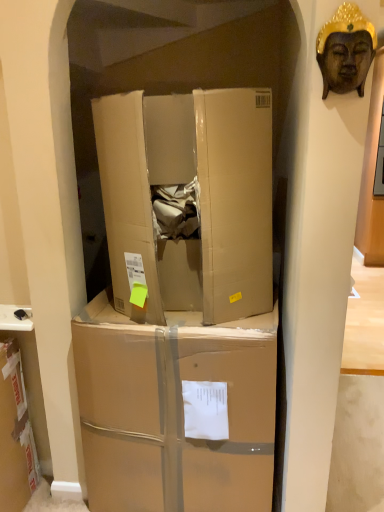
This screenshot has height=512, width=384. Identify the location of brown cardboard box at center, the 2th box positioned from the top. click(x=174, y=411).

Between point (206, 440) and point (371, 34), which one is positioned in front?

The point (371, 34) is more forward.

You are a GUI agent. You are given a task and a screenshot of the screen. Output one action in this format:
    pyautogui.click(x=<x>, y=<y>)
    Task: Click on the person above the brown cardboard box at center, arranged as the first box when ordered from the bottom (from a real-world perspective)
    
    Given the screenshot: What is the action you would take?
    pyautogui.click(x=345, y=50)

Considering the sizes of objects brown cardboard box at center, arranged as the first box when ordered from the bottom, and wooden buddha head at upper right in the image provided, who is shorter, brown cardboard box at center, arranged as the first box when ordered from the bottom, or wooden buddha head at upper right?

wooden buddha head at upper right.

Based on the photo, from a real-world perspective, which is physically above, brown cardboard box at center, the 2th box positioned from the top, or cardboard box at center, the 1th box in the top-to-bottom sequence?

In real-world perspective, cardboard box at center, the 1th box in the top-to-bottom sequence, is above.

Locate an element on the screen. The image size is (384, 512). box above the brown cardboard box at center, the 2th box positioned from the top (from the image's perspective) is located at coordinates (195, 203).

Would you say cardboard box at center, the 1th box in the top-to-bottom sequence, is part of brown cardboard box at center, the 2th box positioned from the top,'s contents?

No, cardboard box at center, the 1th box in the top-to-bottom sequence, is not inside brown cardboard box at center, the 2th box positioned from the top.

Is the position of brown cardboard box at center, arranged as the first box when ordered from the bottom, more distant than that of cardboard box at center, which is counted as the second box, starting from the bottom?

That is True.

From the image's perspective, is cardboard box at center, which is counted as the second box, starting from the bottom, on brown cardboard box at center, the 2th box positioned from the top?

Yes.

Is cardboard box at center, which is counted as the second box, starting from the bottom, closer to the viewer compared to brown cardboard box at center, arranged as the first box when ordered from the bottom?

Yes, cardboard box at center, which is counted as the second box, starting from the bottom, is in front of brown cardboard box at center, arranged as the first box when ordered from the bottom.

Is cardboard box at center, which is counted as the second box, starting from the bottom, positioned far away from brown cardboard box at center, the 2th box positioned from the top?

cardboard box at center, which is counted as the second box, starting from the bottom, is near brown cardboard box at center, the 2th box positioned from the top, not far away.

Locate an element on the screen. The image size is (384, 512). person on the right of the cardboard box at center, which is counted as the second box, starting from the bottom is located at coordinates (345, 50).

Is cardboard box at center, the 1th box in the top-to-bottom sequence, not close to wooden buddha head at upper right?

No, cardboard box at center, the 1th box in the top-to-bottom sequence, is not far away from wooden buddha head at upper right.

Can you tell me how much cardboard box at center, which is counted as the second box, starting from the bottom, and wooden buddha head at upper right differ in facing direction?

cardboard box at center, which is counted as the second box, starting from the bottom, and wooden buddha head at upper right are facing 3.39 degrees away from each other.

How distant is wooden buddha head at upper right from cardboard box at center, which is counted as the second box, starting from the bottom?

wooden buddha head at upper right and cardboard box at center, which is counted as the second box, starting from the bottom, are 21.15 inches apart from each other.

Which is behind, point (347, 9) or point (229, 89)?

Positioned behind is point (229, 89).

Is wooden buddha head at upper right located outside cardboard box at center, the 1th box in the top-to-bottom sequence?

Indeed, wooden buddha head at upper right is completely outside cardboard box at center, the 1th box in the top-to-bottom sequence.

Is wooden buddha head at upper right directly adjacent to brown cardboard box at center, the 2th box positioned from the top?

No, wooden buddha head at upper right is not next to brown cardboard box at center, the 2th box positioned from the top.

Does wooden buddha head at upper right have a larger size compared to brown cardboard box at center, the 2th box positioned from the top?

Incorrect, wooden buddha head at upper right is not larger than brown cardboard box at center, the 2th box positioned from the top.

Is wooden buddha head at upper right not within brown cardboard box at center, arranged as the first box when ordered from the bottom?

Indeed, wooden buddha head at upper right is completely outside brown cardboard box at center, arranged as the first box when ordered from the bottom.

Based on the photo, which of these two, wooden buddha head at upper right or brown cardboard box at center, the 2th box positioned from the top, is wider?

With larger width is brown cardboard box at center, the 2th box positioned from the top.

The width and height of the screenshot is (384, 512). In order to click on the 2nd box behind when counting from the wooden buddha head at upper right in this screenshot , I will do `click(174, 411)`.

Locate an element on the screen. The image size is (384, 512). box above the brown cardboard box at center, the 2th box positioned from the top (from a real-world perspective) is located at coordinates (195, 203).

Based on their spatial positions, is cardboard box at center, the 1th box in the top-to-bottom sequence, or wooden buddha head at upper right closer to brown cardboard box at center, the 2th box positioned from the top?

cardboard box at center, the 1th box in the top-to-bottom sequence, lies closer to brown cardboard box at center, the 2th box positioned from the top, than the other object.

Estimate the real-world distances between objects in this image. Which object is closer to wooden buddha head at upper right, cardboard box at center, which is counted as the second box, starting from the bottom, or brown cardboard box at center, arranged as the first box when ordered from the bottom?

Among the two, cardboard box at center, which is counted as the second box, starting from the bottom, is located nearer to wooden buddha head at upper right.

Estimate the real-world distances between objects in this image. Which object is further from wooden buddha head at upper right, brown cardboard box at center, the 2th box positioned from the top, or cardboard box at center, the 1th box in the top-to-bottom sequence?

brown cardboard box at center, the 2th box positioned from the top, is further to wooden buddha head at upper right.

Estimate the real-world distances between objects in this image. Which object is closer to cardboard box at center, which is counted as the second box, starting from the bottom, wooden buddha head at upper right or brown cardboard box at center, the 2th box positioned from the top?

brown cardboard box at center, the 2th box positioned from the top, is positioned closer to the anchor cardboard box at center, which is counted as the second box, starting from the bottom.

Based on their spatial positions, is brown cardboard box at center, arranged as the first box when ordered from the bottom, or wooden buddha head at upper right closer to cardboard box at center, the 1th box in the top-to-bottom sequence?

brown cardboard box at center, arranged as the first box when ordered from the bottom, is positioned closer to the anchor cardboard box at center, the 1th box in the top-to-bottom sequence.

From the image, which object appears to be nearer to brown cardboard box at center, arranged as the first box when ordered from the bottom, wooden buddha head at upper right or cardboard box at center, the 1th box in the top-to-bottom sequence?

cardboard box at center, the 1th box in the top-to-bottom sequence, is positioned closer to the anchor brown cardboard box at center, arranged as the first box when ordered from the bottom.

Locate an element on the screen. The width and height of the screenshot is (384, 512). box between wooden buddha head at upper right and brown cardboard box at center, arranged as the first box when ordered from the bottom, in the up-down direction is located at coordinates (195, 203).